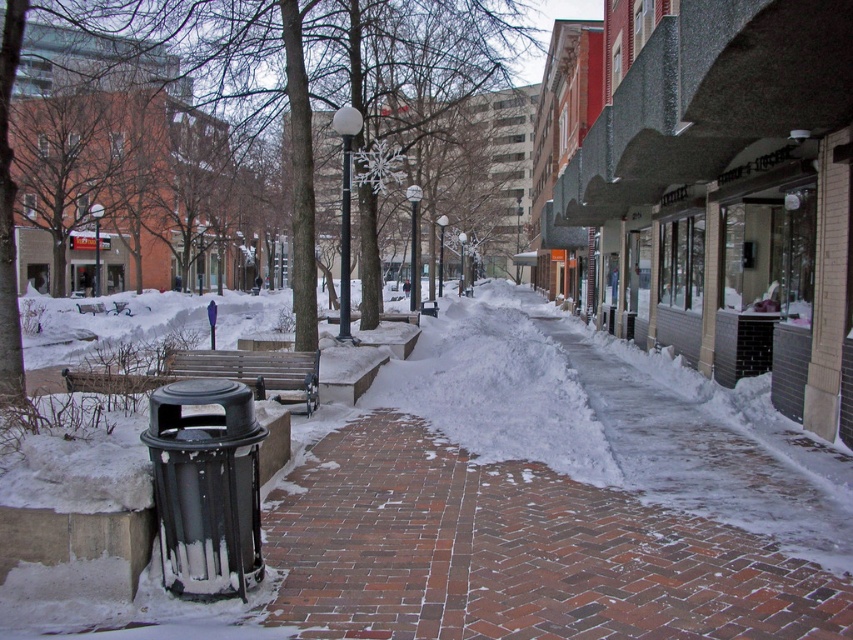
Which is behind, point (541, 634) or point (277, 378)?

The point (277, 378) is more distant.

The image size is (853, 640). In order to click on brick pavement at center in this screenshot , I will do `click(515, 552)`.

You are a GUI agent. You are given a task and a screenshot of the screen. Output one action in this format:
    pyautogui.click(x=<x>, y=<y>)
    Task: Click on the brick pavement at center
    
    Given the screenshot: What is the action you would take?
    pyautogui.click(x=515, y=552)